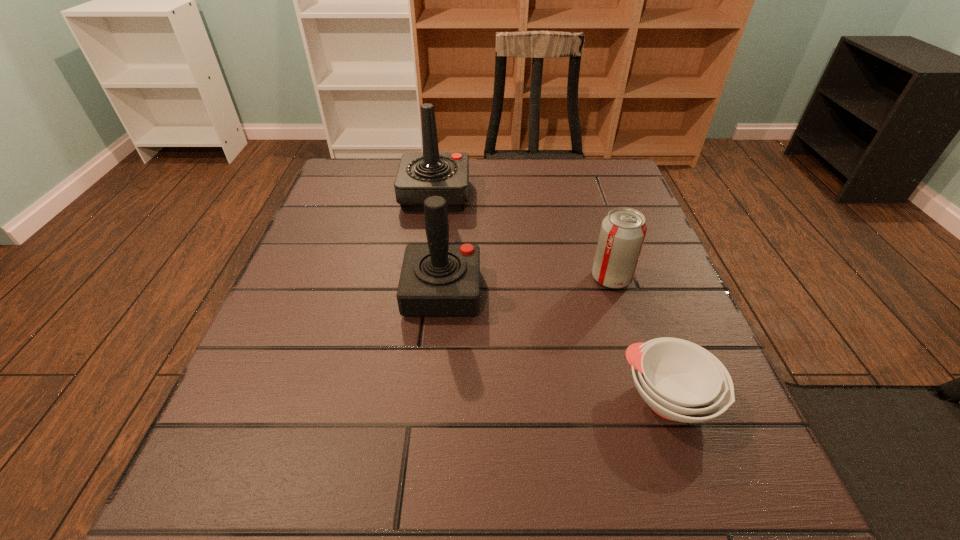
Find the location of a particular element. The width and height of the screenshot is (960, 540). free area in between the soda can and the nearer joystick is located at coordinates (527, 285).

Find the location of `free space between the soup bowl and the soda can`. free space between the soup bowl and the soda can is located at coordinates (640, 338).

Where is `empty location between the soda can and the farthest object`? This screenshot has height=540, width=960. empty location between the soda can and the farthest object is located at coordinates (523, 237).

Find the location of `free space between the farther joystick and the soup bowl`. free space between the farther joystick and the soup bowl is located at coordinates (552, 296).

Choose which object is the second nearest neighbor to the soda can. Please provide its 2D coordinates. Your answer should be formatted as a tuple, i.e. [(x, y)], where the tuple contains the x and y coordinates of a point satisfying the conditions above.

[(438, 279)]

Where is `object that stands as the third closest to the shortest object`? object that stands as the third closest to the shortest object is located at coordinates (420, 175).

Identify the location of free space in the image that satisfies the following two spatial constraints: 1. on the base of the nearer joystick; 2. on the left side of the shortest object. The image size is (960, 540). (433, 399).

Locate an element on the screen. The image size is (960, 540). free spot that satisfies the following two spatial constraints: 1. on the back side of the nearest object; 2. on the front-facing side of the farther joystick is located at coordinates (597, 195).

You are a GUI agent. You are given a task and a screenshot of the screen. Output one action in this format:
    pyautogui.click(x=<x>, y=<y>)
    Task: Click on the vacant region that satisfies the following two spatial constraints: 1. on the base of the soup bowl; 2. on the left side of the nearer joystick
    
    Given the screenshot: What is the action you would take?
    pyautogui.click(x=433, y=399)

Identify the location of vacant space that satisfies the following two spatial constraints: 1. on the base of the nearest object; 2. on the right side of the nearer joystick. This screenshot has height=540, width=960. (433, 399).